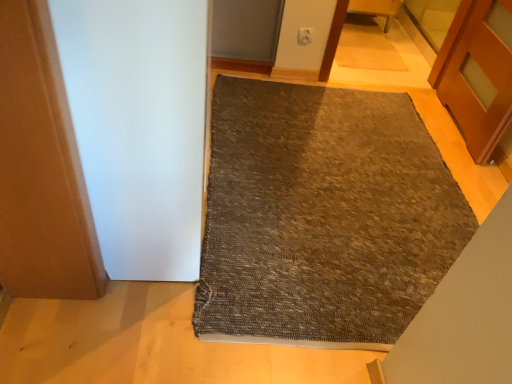
Question: Does wooden chair at upper center appear on the right side of textured gray mat at center?

Choices:
 (A) no
 (B) yes

Answer: (B)

Question: From the image's perspective, is wooden chair at upper center beneath textured gray mat at center?

Choices:
 (A) no
 (B) yes

Answer: (A)

Question: Does wooden chair at upper center have a lesser height compared to textured gray mat at center?

Choices:
 (A) yes
 (B) no

Answer: (B)

Question: Is wooden chair at upper center looking in the opposite direction of textured gray mat at center?

Choices:
 (A) yes
 (B) no

Answer: (B)

Question: From a real-world perspective, is wooden chair at upper center positioned under textured gray mat at center based on gravity?

Choices:
 (A) yes
 (B) no

Answer: (B)

Question: Can textured gray mat at center be found inside wooden chair at upper center?

Choices:
 (A) no
 (B) yes

Answer: (A)

Question: From the image's perspective, is textured gray mat at center above white matte screen door at left?

Choices:
 (A) yes
 (B) no

Answer: (B)

Question: Is textured gray mat at center thinner than white matte screen door at left?

Choices:
 (A) no
 (B) yes

Answer: (A)

Question: Are textured gray mat at center and white matte screen door at left making contact?

Choices:
 (A) no
 (B) yes

Answer: (A)

Question: From a real-world perspective, is textured gray mat at center over white matte screen door at left?

Choices:
 (A) yes
 (B) no

Answer: (B)

Question: Does textured gray mat at center come in front of white matte screen door at left?

Choices:
 (A) no
 (B) yes

Answer: (A)

Question: Is textured gray mat at center facing away from white matte screen door at left?

Choices:
 (A) no
 (B) yes

Answer: (A)

Question: Is white matte screen door at left bigger than textured gray mat at center?

Choices:
 (A) no
 (B) yes

Answer: (B)